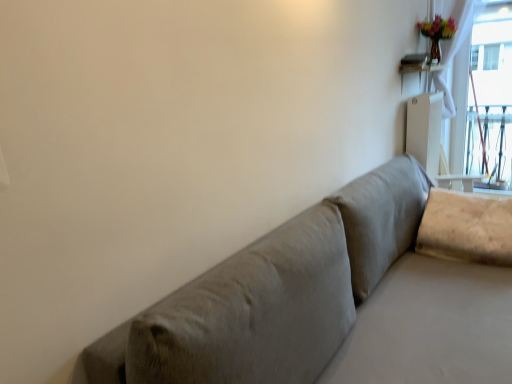
Question: In the image, is white glossy table at upper right positioned in front of or behind beige fabric pillow at right?

Choices:
 (A) behind
 (B) front

Answer: (A)

Question: Based on their sizes in the image, would you say white glossy table at upper right is bigger or smaller than beige fabric pillow at right?

Choices:
 (A) small
 (B) big

Answer: (A)

Question: Would you say white glossy table at upper right is inside or outside beige fabric pillow at right?

Choices:
 (A) outside
 (B) inside

Answer: (A)

Question: In terms of width, does beige fabric pillow at right look wider or thinner when compared to white glossy table at upper right?

Choices:
 (A) wide
 (B) thin

Answer: (A)

Question: In terms of height, does beige fabric pillow at right look taller or shorter compared to white glossy table at upper right?

Choices:
 (A) tall
 (B) short

Answer: (A)

Question: Is beige fabric pillow at right situated inside white glossy table at upper right or outside?

Choices:
 (A) outside
 (B) inside

Answer: (A)

Question: From the image's perspective, relative to white glossy table at upper right, is beige fabric pillow at right above or below?

Choices:
 (A) above
 (B) below

Answer: (B)